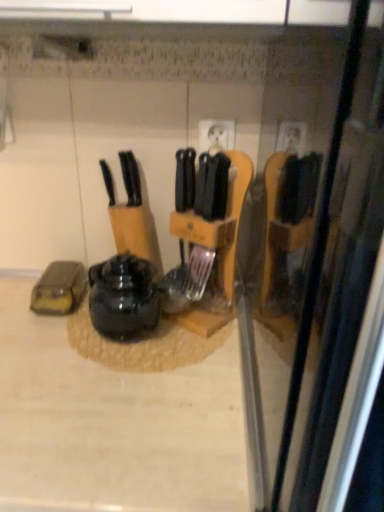
Question: Is shiny black kettle at center shorter than beige laminate counter at center?

Choices:
 (A) no
 (B) yes

Answer: (B)

Question: Considering the relative positions of shiny black kettle at center and beige laminate counter at center in the image provided, is shiny black kettle at center in front of beige laminate counter at center?

Choices:
 (A) yes
 (B) no

Answer: (B)

Question: Is shiny black kettle at center located outside beige laminate counter at center?

Choices:
 (A) yes
 (B) no

Answer: (A)

Question: From a real-world perspective, is shiny black kettle at center beneath beige laminate counter at center?

Choices:
 (A) no
 (B) yes

Answer: (A)

Question: Is shiny black kettle at center further to the viewer compared to beige laminate counter at center?

Choices:
 (A) yes
 (B) no

Answer: (A)

Question: In the image, is beige laminate counter at center positioned in front of or behind black plastic knife at center?

Choices:
 (A) front
 (B) behind

Answer: (A)

Question: From a real-world perspective, relative to black plastic knife at center, is beige laminate counter at center vertically above or below?

Choices:
 (A) above
 (B) below

Answer: (B)

Question: Does point (94, 402) appear closer or farther from the camera than point (114, 196)?

Choices:
 (A) farther
 (B) closer

Answer: (B)

Question: Is beige laminate counter at center to the left or to the right of black plastic knife at center in the image?

Choices:
 (A) left
 (B) right

Answer: (A)

Question: Based on their sizes in the image, would you say black plastic knife at center is bigger or smaller than beige laminate counter at center?

Choices:
 (A) small
 (B) big

Answer: (A)

Question: Considering the positions of point (104, 170) and point (64, 430), is point (104, 170) closer or farther from the camera than point (64, 430)?

Choices:
 (A) farther
 (B) closer

Answer: (A)

Question: In the image, is black plastic knife at center on the left side or the right side of beige laminate counter at center?

Choices:
 (A) left
 (B) right

Answer: (B)

Question: From the image's perspective, relative to beige laminate counter at center, is black plastic knife at center above or below?

Choices:
 (A) below
 (B) above

Answer: (B)

Question: In terms of height, does shiny black kettle at center look taller or shorter compared to black plastic knife at center?

Choices:
 (A) tall
 (B) short

Answer: (A)

Question: Is shiny black kettle at center in front of or behind black plastic knife at center in the image?

Choices:
 (A) behind
 (B) front

Answer: (B)